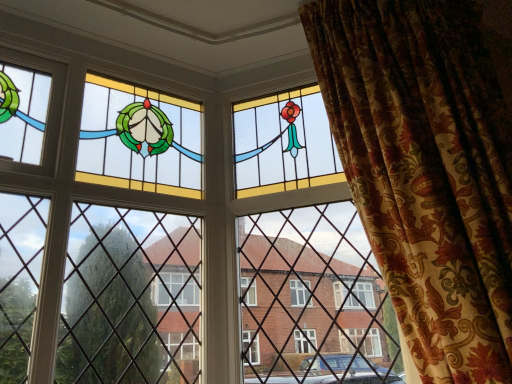
Question: In terms of height, does stained glass window at center look taller or shorter compared to velvet floral curtain at right?

Choices:
 (A) tall
 (B) short

Answer: (B)

Question: Is stained glass window at center inside the boundaries of velvet floral curtain at right, or outside?

Choices:
 (A) outside
 (B) inside

Answer: (A)

Question: Does point (264, 142) appear closer or farther from the camera than point (409, 102)?

Choices:
 (A) closer
 (B) farther

Answer: (B)

Question: From a real-world perspective, is velvet floral curtain at right physically located above or below stained glass window at center?

Choices:
 (A) above
 (B) below

Answer: (B)

Question: Considering the positions of velvet floral curtain at right and stained glass window at center in the image, is velvet floral curtain at right bigger or smaller than stained glass window at center?

Choices:
 (A) small
 (B) big

Answer: (B)

Question: Do you think velvet floral curtain at right is within stained glass window at center, or outside of it?

Choices:
 (A) outside
 (B) inside

Answer: (A)

Question: Based on their positions, is velvet floral curtain at right located to the left or right of stained glass window at center?

Choices:
 (A) right
 (B) left

Answer: (A)